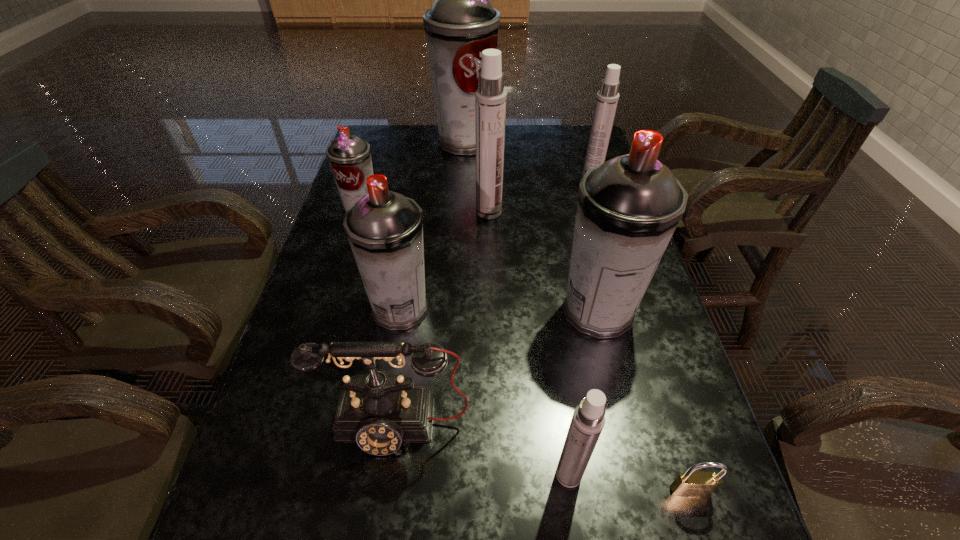
Image resolution: width=960 pixels, height=540 pixels. I want to click on the biggest gray aerosol can, so click(462, 23).

Locate an element on the screen. the tallest aerosol can is located at coordinates (462, 23).

Locate an element on the screen. The width and height of the screenshot is (960, 540). the leftmost white aerosol can is located at coordinates (490, 98).

Find the location of `the second farthest white aerosol can`. the second farthest white aerosol can is located at coordinates (490, 98).

This screenshot has width=960, height=540. Find the location of `the third smallest gray aerosol can`. the third smallest gray aerosol can is located at coordinates (628, 208).

The width and height of the screenshot is (960, 540). I want to click on the eighth nearest object, so click(x=607, y=98).

At what (x,y) coordinates should I click in order to perform the action: click on the second farthest aerosol can. Please return your answer as a coordinate pair (x, y). This screenshot has height=540, width=960. Looking at the image, I should click on (607, 98).

I want to click on the third biggest gray aerosol can, so click(x=385, y=229).

What are the coordinates of `the third nearest gray aerosol can` in the screenshot? It's located at (349, 156).

Where is `the leftmost aerosol can`? the leftmost aerosol can is located at coordinates (349, 156).